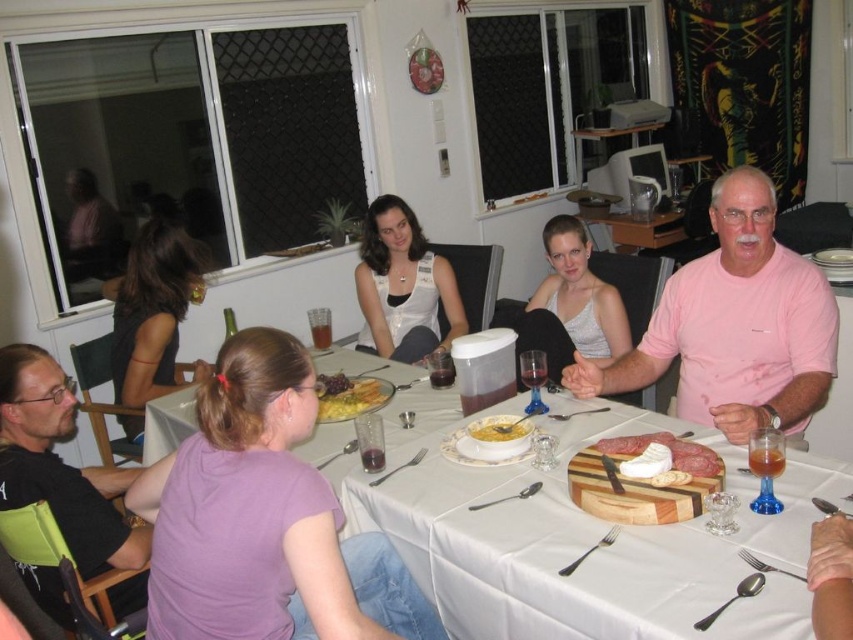
Question: Can you confirm if pink cotton shirt at upper right is thinner than white lace tank top at center?

Choices:
 (A) yes
 (B) no

Answer: (B)

Question: Which of the following is the farthest from the observer?

Choices:
 (A) (122, 529)
 (B) (465, 449)
 (C) (316, 472)
 (D) (636, 508)

Answer: (B)

Question: Is the position of black t-shirt at left more distant than that of yellow matte soup bowl at center?

Choices:
 (A) no
 (B) yes

Answer: (A)

Question: Which point is farther to the camera?

Choices:
 (A) yellow matte plate at center
 (B) smooth white cheese at center
 (C) black fabric dress at left
 (D) yellow matte soup bowl at center

Answer: (C)

Question: Does black t-shirt at left appear on the right side of white lace tank top at center?

Choices:
 (A) no
 (B) yes

Answer: (A)

Question: Which point appears farthest from the camera in this image?

Choices:
 (A) (299, 372)
 (B) (502, 428)
 (C) (717, 580)
 (D) (135, 300)

Answer: (D)